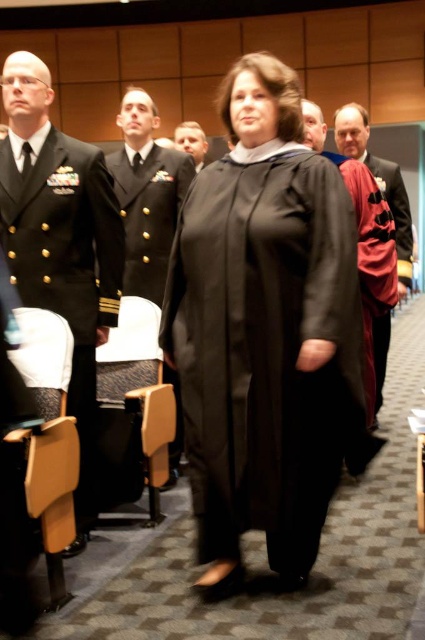
From the picture: Who is taller, tan leather chair at lower left or matte black uniform at center?

tan leather chair at lower left is taller.

Between tan leather chair at lower left and matte black uniform at center, which one has less height?

matte black uniform at center

This screenshot has height=640, width=425. I want to click on tan leather chair at lower left, so click(51, 492).

Does matte black gown at center have a greater width compared to red velvet scarf at right?

Yes.

Is point (289, 481) behind point (399, 218)?

No, (289, 481) is closer to viewer.

This screenshot has width=425, height=640. Find the location of `matte black gown at center`. matte black gown at center is located at coordinates (263, 330).

Can you confirm if velvet burgundy robe at center is positioned to the left of matte black uniform at center?

Incorrect, velvet burgundy robe at center is not on the left side of matte black uniform at center.

Does velvet burgundy robe at center appear over matte black uniform at center?

No, velvet burgundy robe at center is not above matte black uniform at center.

Who is more distant from viewer, (323, 125) or (197, 157)?

Point (197, 157)

Find the location of a particular element. This screenshot has width=425, height=640. velvet burgundy robe at center is located at coordinates pos(363,241).